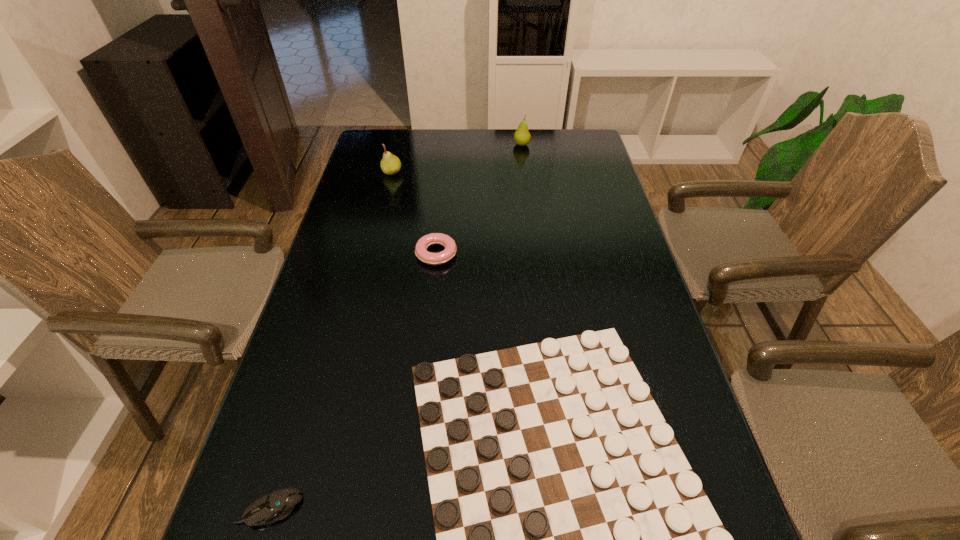
Find the location of a particular element. object that is positioned at the far edge is located at coordinates (522, 137).

Locate an element on the screen. pear at the left edge is located at coordinates (390, 164).

What are the coordinates of `computer mouse at the left edge` in the screenshot? It's located at (274, 506).

What are the coordinates of `vacant area at the far edge of the desktop` in the screenshot? It's located at (493, 145).

In order to click on vacant area at the left edge in this screenshot , I will do `click(330, 302)`.

Where is `vacant area at the right edge of the desktop`? The width and height of the screenshot is (960, 540). vacant area at the right edge of the desktop is located at coordinates (595, 254).

Locate an element on the screen. The height and width of the screenshot is (540, 960). free region at the far left corner is located at coordinates (411, 133).

I want to click on vacant space that's between the doughnut and the left pear, so click(414, 213).

The image size is (960, 540). I want to click on vacant region between the computer mouse and the third nearest object, so click(353, 381).

Find the location of a particular element. The width and height of the screenshot is (960, 540). free spot between the doughnut and the computer mouse is located at coordinates (353, 381).